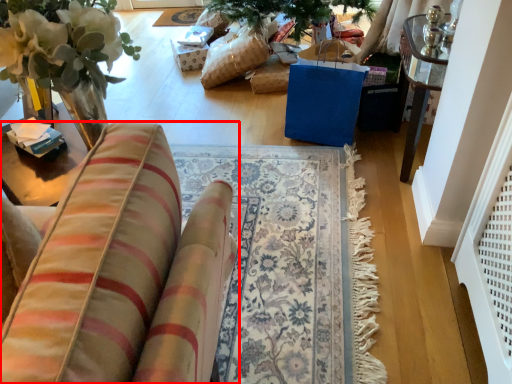
Question: Observing the image, what is the correct spatial positioning of furniture (annotated by the red box) in reference to mat?

Choices:
 (A) right
 (B) left

Answer: (A)